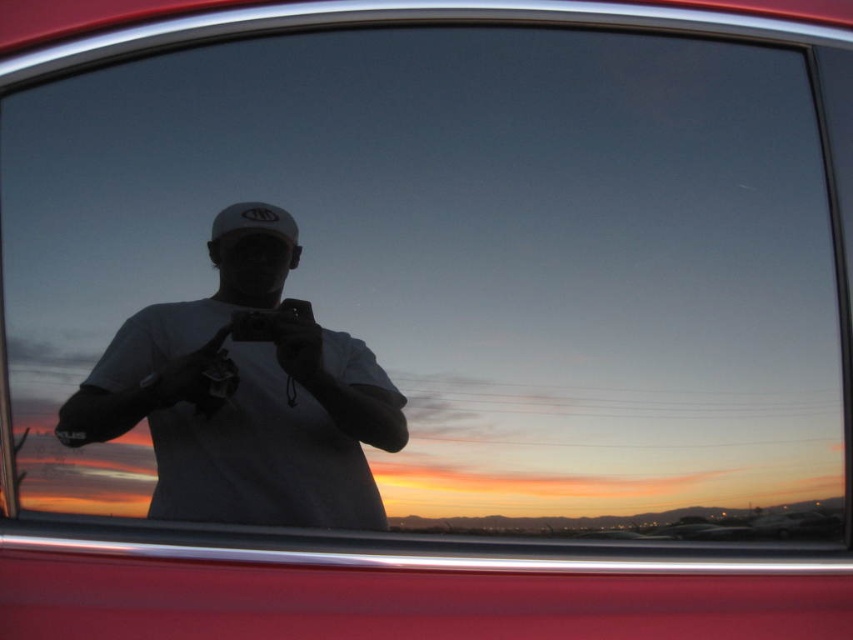
Question: Which point is closer to the camera?

Choices:
 (A) (289, 237)
 (B) (234, 493)

Answer: (B)

Question: Does white matte shirt at center have a lesser width compared to white matte baseball hat at center?

Choices:
 (A) yes
 (B) no

Answer: (B)

Question: Which object is farther from the camera taking this photo?

Choices:
 (A) white matte shirt at center
 (B) white matte baseball hat at center

Answer: (B)

Question: Which point is farther to the camera?

Choices:
 (A) white matte baseball hat at center
 (B) white matte shirt at center

Answer: (A)

Question: Is white matte shirt at center thinner than white matte baseball hat at center?

Choices:
 (A) no
 (B) yes

Answer: (A)

Question: Is white matte shirt at center further to camera compared to white matte baseball hat at center?

Choices:
 (A) yes
 (B) no

Answer: (B)